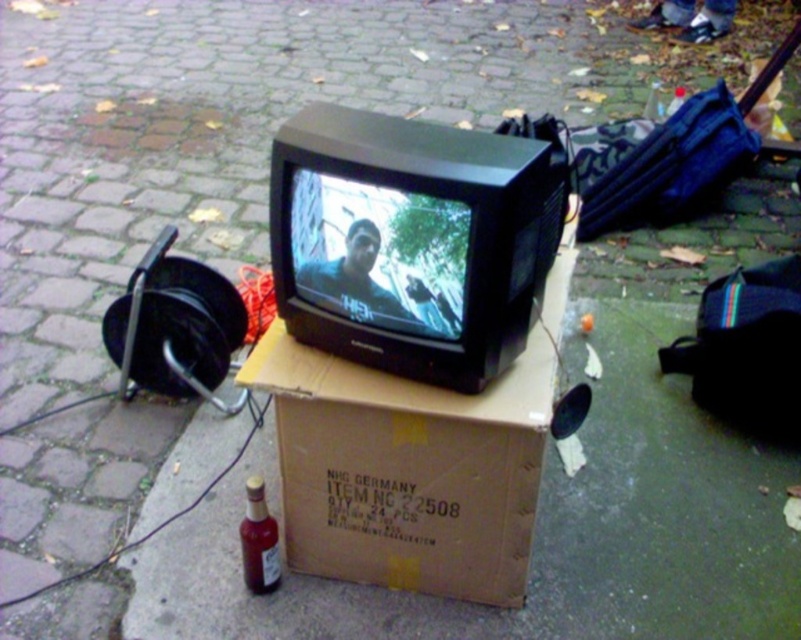
Which is below, brown cardboard box at center or translucent amber glass bottle at lower left?

translucent amber glass bottle at lower left is below.

At what (x,y) coordinates should I click in order to perform the action: click on brown cardboard box at center. Please return your answer as a coordinate pair (x, y). The image size is (801, 640). Looking at the image, I should click on (411, 465).

Image resolution: width=801 pixels, height=640 pixels. I want to click on brown cardboard box at center, so click(x=411, y=465).